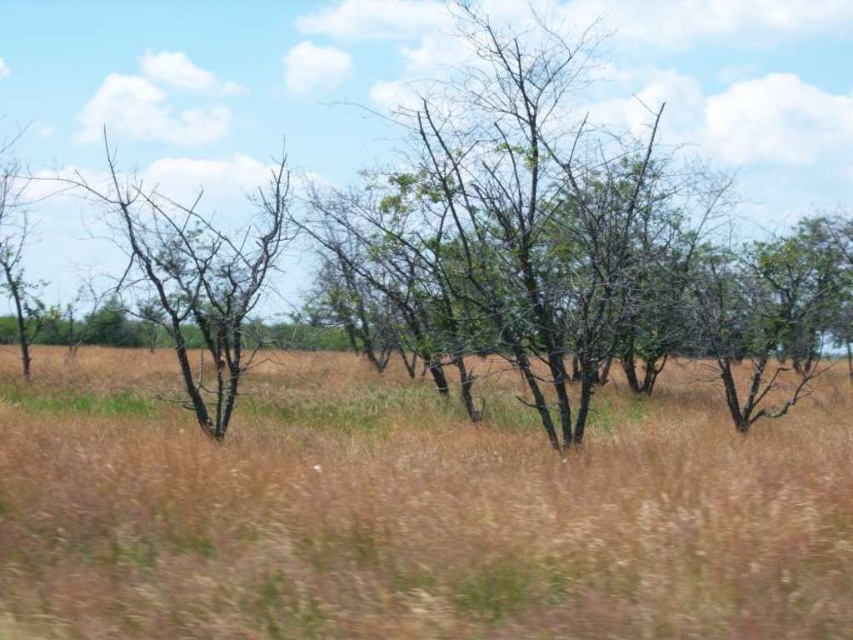
You are standing in the rural landscape and want to take a photo of the brown grass at center and the brown bark tree at center. Which object should you focus on first to ensure both are in the frame?

Since the brown grass at center is closer to the viewer than the brown bark tree at center, you should focus on the brown grass at center first to ensure both are in the frame as they are at different distances.

You are standing at the origin point in the image and want to walk to the brown grass at center. What are the coordinates you need to move to?

The coordinates to move to are 0.797 in the x direction and 0.483 in the y direction.